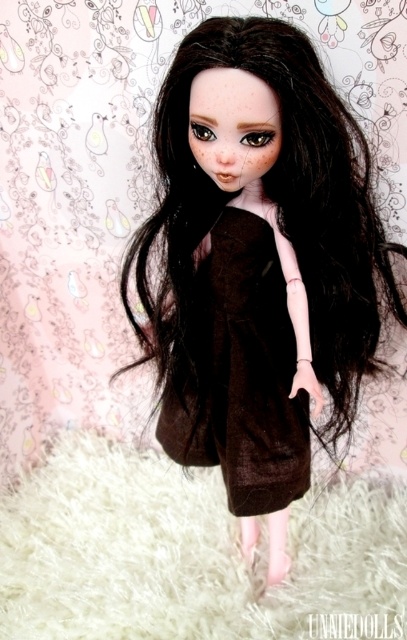
You are an artist trying to draw the doll in the image. You want to add a highlight to the point that is closer to you. Which point should you choose between point (207, 177) and point (277, 305)?

Point (207, 177) is closer to the viewer than point (277, 305), so you should choose point (207, 177) to add the highlight.

You are a fashion designer evaluating the doll for a new outfit. Considering the doll has black silky hair at center and brown matte dress at center, which of these two items has a greater width?

The black silky hair at center has a greater width than the brown matte dress at center according to the description.

You are a toy collector who wants to place a new doll on a shelf. The shelf has a height limit of 36 inches. The doll is positioned at point (369, 358). Will the doll exceed the shelf height limit?

The doll is 39.07 inches tall, which exceeds the 36 inch height limit, so it will not fit on the shelf.